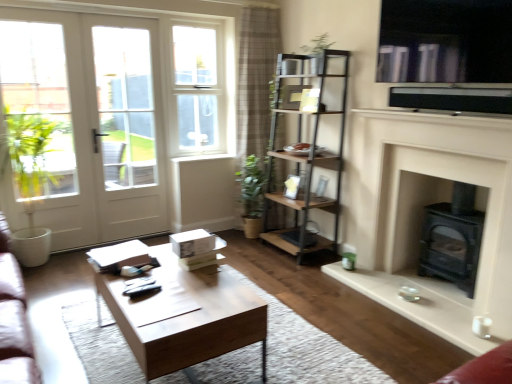
I want to click on free space below metallic silver window screen at upper right (from a real-world perspective), so click(449, 88).